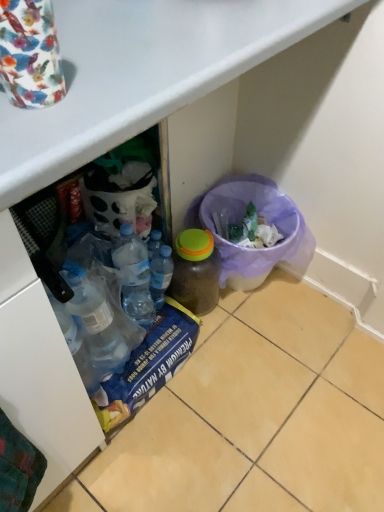
Question: Does purple mesh bin at lower right have a lesser height compared to transparent plastic bottle at center, acting as the 1th bottle starting from the left?

Choices:
 (A) no
 (B) yes

Answer: (A)

Question: From the image's perspective, is purple mesh bin at lower right on transparent plastic bottle at center, acting as the 1th bottle starting from the left?

Choices:
 (A) yes
 (B) no

Answer: (A)

Question: Does purple mesh bin at lower right have a larger size compared to transparent plastic bottle at center, which appears as the 2th bottle when viewed from the right?

Choices:
 (A) yes
 (B) no

Answer: (A)

Question: Can you confirm if purple mesh bin at lower right is smaller than transparent plastic bottle at center, acting as the 1th bottle starting from the left?

Choices:
 (A) yes
 (B) no

Answer: (B)

Question: Can we say purple mesh bin at lower right lies outside transparent plastic bottle at center, acting as the 1th bottle starting from the left?

Choices:
 (A) no
 (B) yes

Answer: (B)

Question: Which is correct: translucent plastic bottle at center, the 1th bottle from the right, is inside transparent plastic bottle at center, acting as the 1th bottle starting from the left, or outside of it?

Choices:
 (A) outside
 (B) inside

Answer: (A)

Question: From the image's perspective, is translucent plastic bottle at center, the 1th bottle from the right, positioned above or below transparent plastic bottle at center, which appears as the 2th bottle when viewed from the right?

Choices:
 (A) above
 (B) below

Answer: (B)

Question: Considering the positions of point (205, 295) and point (165, 269), is point (205, 295) closer or farther from the camera than point (165, 269)?

Choices:
 (A) farther
 (B) closer

Answer: (A)

Question: Considering the relative positions of translucent plastic bottle at center, placed as the 2th bottle when sorted from left to right, and transparent plastic bottle at center, which appears as the 2th bottle when viewed from the right, in the image provided, is translucent plastic bottle at center, placed as the 2th bottle when sorted from left to right, to the left or to the right of transparent plastic bottle at center, which appears as the 2th bottle when viewed from the right,?

Choices:
 (A) right
 (B) left

Answer: (A)

Question: Relative to translucent plastic bottle at center, placed as the 2th bottle when sorted from left to right, is transparent plastic bottle at center, acting as the 1th bottle starting from the left, in front or behind?

Choices:
 (A) front
 (B) behind

Answer: (A)

Question: From the image's perspective, is transparent plastic bottle at center, acting as the 1th bottle starting from the left, above or below translucent plastic bottle at center, placed as the 2th bottle when sorted from left to right?

Choices:
 (A) above
 (B) below

Answer: (A)

Question: Considering the positions of transparent plastic bottle at center, acting as the 1th bottle starting from the left, and translucent plastic bottle at center, placed as the 2th bottle when sorted from left to right, in the image, is transparent plastic bottle at center, acting as the 1th bottle starting from the left, bigger or smaller than translucent plastic bottle at center, placed as the 2th bottle when sorted from left to right,?

Choices:
 (A) big
 (B) small

Answer: (B)

Question: Would you say transparent plastic bottle at center, which appears as the 2th bottle when viewed from the right, is to the left or to the right of translucent plastic bottle at center, the 1th bottle from the right, in the picture?

Choices:
 (A) right
 (B) left

Answer: (B)

Question: From a real-world perspective, relative to transparent plastic bottle at center, which appears as the 2th bottle when viewed from the right, is purple mesh bin at lower right vertically above or below?

Choices:
 (A) above
 (B) below

Answer: (B)

Question: Would you say purple mesh bin at lower right is inside or outside transparent plastic bottle at center, which appears as the 2th bottle when viewed from the right?

Choices:
 (A) inside
 (B) outside

Answer: (B)